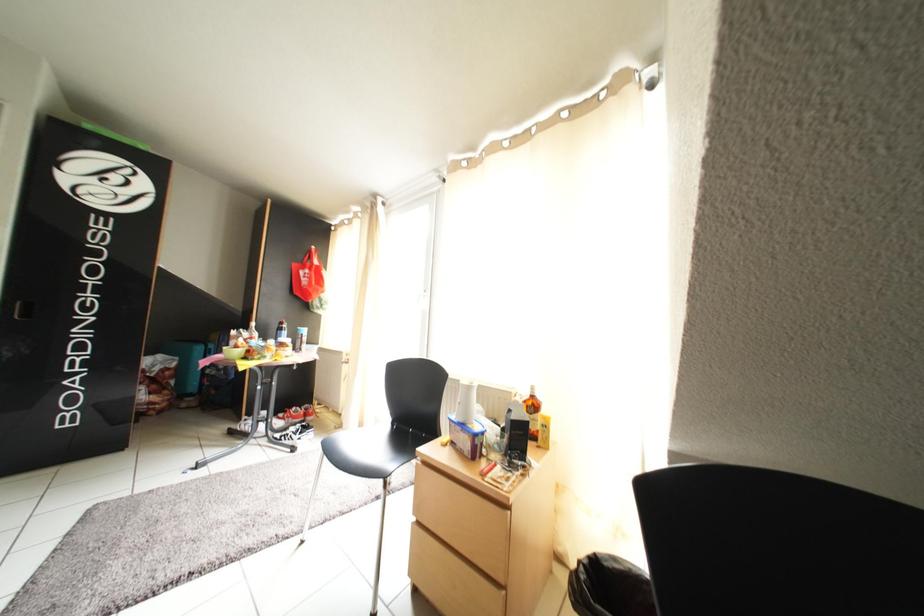
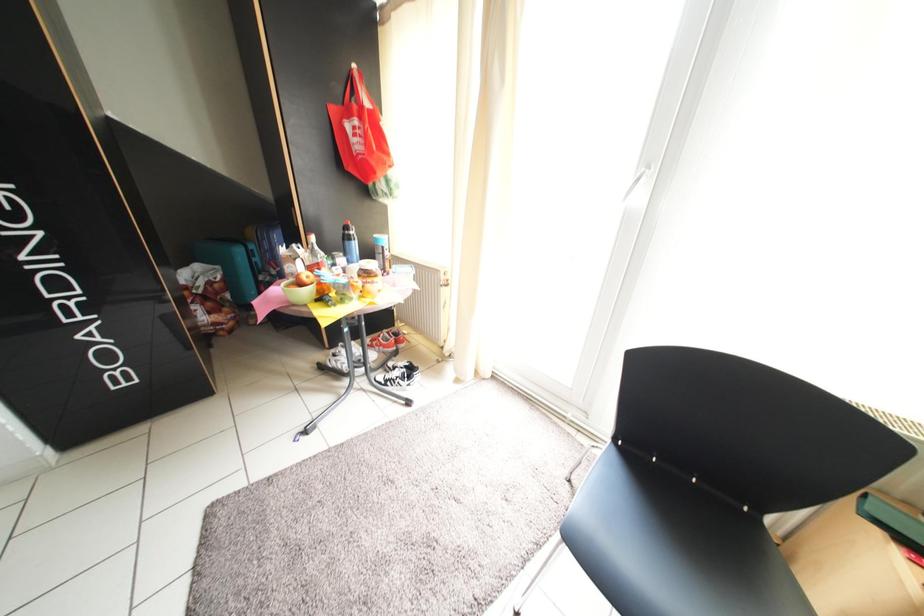
The images are taken continuously from a first-person perspective. In which direction are you moving?

The cameraman moved toward left, forward.